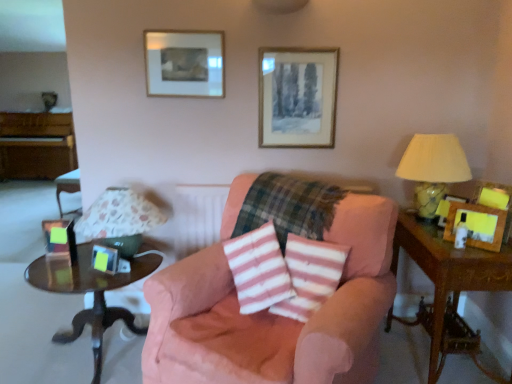
Describe the element at coordinates (90, 290) in the screenshot. Image resolution: width=512 pixels, height=384 pixels. I see `wooden side table at left, the 1th table positioned from the left` at that location.

The width and height of the screenshot is (512, 384). Find the location of `plaid fabric at center`. plaid fabric at center is located at coordinates (288, 206).

Image resolution: width=512 pixels, height=384 pixels. In order to click on gold-framed picture at upper center, the 4th picture frame positioned from the bottom in this screenshot , I will do click(x=297, y=97).

Measure the distance between gold-framed picture at upper center, placed as the 2th picture frame when sorted from right to left, and camera.

The distance of gold-framed picture at upper center, placed as the 2th picture frame when sorted from right to left, from camera is 7.68 feet.

What do you see at coordinates (36, 145) in the screenshot?
I see `wooden piano at left` at bounding box center [36, 145].

You are a GUI agent. You are given a task and a screenshot of the screen. Output one action in this format:
    pyautogui.click(x=<x>, y=<y>)
    Task: Click on the wooden piano at left
    This screenshot has width=512, height=384.
    Given the screenshot: What is the action you would take?
    pyautogui.click(x=36, y=145)

How much space does matte black picture frame at left, which is counted as the 5th picture frame, starting from the right, occupy horizontally?

matte black picture frame at left, which is counted as the 5th picture frame, starting from the right, is 6.41 inches wide.

The height and width of the screenshot is (384, 512). What do you see at coordinates (310, 275) in the screenshot?
I see `pink striped fabric at center` at bounding box center [310, 275].

Identify the location of wooden side table at left, the 1th table positioned from the left. (90, 290).

From a real-world perspective, is yellow fabric lampshade at right, the 2th table lamp viewed from the left, physically above wooden picture frame at right, the first picture frame viewed from the front?

Yes, from a real-world perspective, yellow fabric lampshade at right, the 2th table lamp viewed from the left, is above wooden picture frame at right, the first picture frame viewed from the front.

In the scene shown: Is yellow fabric lampshade at right, the 1th table lamp positioned from the right, outside of wooden picture frame at right, marked as the third picture frame in a top-to-bottom arrangement?

Yes.

Which object is thinner, yellow fabric lampshade at right, the 2th table lamp viewed from the left, or wooden picture frame at right, placed as the 3th picture frame when sorted from bottom to top?

Thinner between the two is wooden picture frame at right, placed as the 3th picture frame when sorted from bottom to top.

From a real-world perspective, is floral fabric lampshade at left, the 2th table lamp viewed from the right, above or below wooden picture frame at upper center, the 5th picture frame when ordered from front to back?

In terms of real-world spatial position, floral fabric lampshade at left, the 2th table lamp viewed from the right, is below wooden picture frame at upper center, the 5th picture frame when ordered from front to back.

Is floral fabric lampshade at left, the 2th table lamp viewed from the right, next to wooden picture frame at upper center, arranged as the 3th picture frame when viewed from the right, and touching it?

floral fabric lampshade at left, the 2th table lamp viewed from the right, is not next to wooden picture frame at upper center, arranged as the 3th picture frame when viewed from the right, and they're not touching.

Is floral fabric lampshade at left, the 2th table lamp viewed from the right, at the left side of wooden picture frame at upper center, which appears as the 5th picture frame when ordered from the bottom?

Correct, you'll find floral fabric lampshade at left, the 2th table lamp viewed from the right, to the left of wooden picture frame at upper center, which appears as the 5th picture frame when ordered from the bottom.

Considering the positions of point (106, 224) and point (201, 66), is point (106, 224) closer or farther from the camera than point (201, 66)?

Point (106, 224) is positioned closer to the camera compared to point (201, 66).

Would you consider wooden side table at right, marked as the 2th table in a left-to-right arrangement, to be distant from yellow fabric lampshade at right, the 1th table lamp positioned from the right?

wooden side table at right, marked as the 2th table in a left-to-right arrangement, is actually quite close to yellow fabric lampshade at right, the 1th table lamp positioned from the right.

In the image, is wooden side table at right, the 1th table positioned from the right, positioned in front of or behind yellow fabric lampshade at right, the 2th table lamp viewed from the left?

wooden side table at right, the 1th table positioned from the right, is in front of yellow fabric lampshade at right, the 2th table lamp viewed from the left.

How different are the orientations of wooden side table at right, the 1th table positioned from the right, and yellow fabric lampshade at right, the 2th table lamp viewed from the left, in degrees?

0.00116 degrees.

From a real-world perspective, is wooden side table at right, marked as the 2th table in a left-to-right arrangement, above or below yellow fabric lampshade at right, the 1th table lamp positioned from the right?

wooden side table at right, marked as the 2th table in a left-to-right arrangement, is below yellow fabric lampshade at right, the 1th table lamp positioned from the right.

Is wooden piano at left to the left of matte black picture frame at left, placed as the third picture frame when sorted from front to back, from the viewer's perspective?

Correct, you'll find wooden piano at left to the left of matte black picture frame at left, placed as the third picture frame when sorted from front to back.

Could you tell me if wooden piano at left is facing matte black picture frame at left, placed as the third picture frame when sorted from front to back?

No, wooden piano at left is not turned towards matte black picture frame at left, placed as the third picture frame when sorted from front to back.

From the image's perspective, which is below, wooden piano at left or matte black picture frame at left, placed as the third picture frame when sorted from front to back?

matte black picture frame at left, placed as the third picture frame when sorted from front to back.

Is wooden piano at left taller than matte black picture frame at left, the third picture frame viewed from the back?

Indeed, wooden piano at left has a greater height compared to matte black picture frame at left, the third picture frame viewed from the back.

Looking at their sizes, would you say pink striped fabric at center is wider or thinner than wooden side table at left, the 1th table positioned from the left?

In the image, pink striped fabric at center appears to be more narrow than wooden side table at left, the 1th table positioned from the left.

From the image's perspective, is pink striped fabric at center located above or below wooden side table at left, the second table when ordered from right to left?

From the image's perspective, pink striped fabric at center appears above wooden side table at left, the second table when ordered from right to left.

In the image, is pink striped fabric at center positioned in front of or behind wooden side table at left, the 1th table positioned from the left?

Clearly, pink striped fabric at center is in front of wooden side table at left, the 1th table positioned from the left.

How many degrees apart are the facing directions of pink striped fabric at center and wooden side table at left, the second table when ordered from right to left?

The facing directions of pink striped fabric at center and wooden side table at left, the second table when ordered from right to left, are 34.6 degrees apart.

From the picture: Which of these two, wooden side table at left, the 1th table positioned from the left, or gold-framed picture at upper center, marked as the second picture frame in a top-to-bottom arrangement, is wider?

wooden side table at left, the 1th table positioned from the left, is wider.

Between wooden side table at left, the 1th table positioned from the left, and gold-framed picture at upper center, arranged as the 4th picture frame when viewed from the front, which one has more height?

gold-framed picture at upper center, arranged as the 4th picture frame when viewed from the front, is taller.

I want to click on the 2nd table below when counting from the gold-framed picture at upper center, the second picture frame in the back-to-front sequence (from the image's perspective), so click(90, 290).

From the image's perspective, which is below, wooden side table at left, the 1th table positioned from the left, or gold-framed picture at upper center, marked as the second picture frame in a top-to-bottom arrangement?

wooden side table at left, the 1th table positioned from the left.

Considering the sizes of objects floral fabric lampshade at left, the 2th table lamp viewed from the right, and wooden side table at left, the 1th table positioned from the left, in the image provided, who is wider, floral fabric lampshade at left, the 2th table lamp viewed from the right, or wooden side table at left, the 1th table positioned from the left,?

Wider between the two is wooden side table at left, the 1th table positioned from the left.

Are floral fabric lampshade at left, marked as the first table lamp in a left-to-right arrangement, and wooden side table at left, the second table when ordered from right to left, far apart?

floral fabric lampshade at left, marked as the first table lamp in a left-to-right arrangement, is near wooden side table at left, the second table when ordered from right to left, not far away.

Is floral fabric lampshade at left, marked as the first table lamp in a left-to-right arrangement, to the right of wooden side table at left, the second table when ordered from right to left, from the viewer's perspective?

Yes, floral fabric lampshade at left, marked as the first table lamp in a left-to-right arrangement, is to the right of wooden side table at left, the second table when ordered from right to left.

Image resolution: width=512 pixels, height=384 pixels. I want to click on the 1st picture frame directly beneath the yellow fabric lampshade at right, the 2th table lamp viewed from the left (from a real-world perspective), so click(477, 225).

Where is `the 4th picture frame behind when counting from the floral fabric lampshade at left, the 2th table lamp viewed from the right`? the 4th picture frame behind when counting from the floral fabric lampshade at left, the 2th table lamp viewed from the right is located at coordinates [x=184, y=63].

Which object lies further to the anchor point pink fabric chair at center, wooden picture frame at right, the first picture frame viewed from the right, or wooden side table at left, the 1th table positioned from the left?

wooden picture frame at right, the first picture frame viewed from the right, is positioned further to the anchor pink fabric chair at center.

Looking at this image, looking at the image, which one is located further to pink fabric chair at center, wooden piano at left or matte black picture frame at left, which is counted as the 5th picture frame, starting from the right?

Among the two, wooden piano at left is located further to pink fabric chair at center.

Which object lies nearer to the anchor point plaid fabric at center, metallic silver picture frame at lower left, which ranks as the 2th picture frame in front-to-back order, or wooden piano at left?

Based on the image, metallic silver picture frame at lower left, which ranks as the 2th picture frame in front-to-back order, appears to be nearer to plaid fabric at center.

In the scene shown: Considering their positions, is pink fabric chair at center positioned closer to wooden piano at left than wooden side table at right, the 1th table positioned from the right?

pink fabric chair at center lies closer to wooden piano at left than the other object.

Which object lies further to the anchor point wooden side table at right, the 1th table positioned from the right, wooden picture frame at right, the first picture frame viewed from the front, or plaid fabric at center?

plaid fabric at center.

Based on their spatial positions, is gold-framed picture at upper center, arranged as the 4th picture frame when viewed from the front, or wooden picture frame at right, placed as the fifth picture frame when sorted from left to right, closer to wooden picture frame at upper center, marked as the 3th picture frame in a left-to-right arrangement?

Among the two, gold-framed picture at upper center, arranged as the 4th picture frame when viewed from the front, is located nearer to wooden picture frame at upper center, marked as the 3th picture frame in a left-to-right arrangement.

Which object lies nearer to the anchor point matte black picture frame at left, arranged as the fourth picture frame when viewed from the top, metallic silver picture frame at lower left, which is counted as the 1th picture frame, starting from the bottom, or gold-framed picture at upper center, the second picture frame in the back-to-front sequence?

metallic silver picture frame at lower left, which is counted as the 1th picture frame, starting from the bottom, is positioned closer to the anchor matte black picture frame at left, arranged as the fourth picture frame when viewed from the top.

Considering their positions, is floral fabric lampshade at left, marked as the first table lamp in a left-to-right arrangement, positioned closer to pink striped fabric at center than metallic silver picture frame at lower left, the second picture frame when ordered from left to right?

Based on the image, floral fabric lampshade at left, marked as the first table lamp in a left-to-right arrangement, appears to be nearer to pink striped fabric at center.

You are a GUI agent. You are given a task and a screenshot of the screen. Output one action in this format:
    pyautogui.click(x=<x>, y=<y>)
    Task: Click on the table lamp between floral fabric lampshade at left, the 2th table lamp viewed from the right, and wooden side table at right, marked as the 2th table in a left-to-right arrangement
    This screenshot has height=384, width=512.
    Given the screenshot: What is the action you would take?
    pyautogui.click(x=433, y=169)

At what (x,y) coordinates should I click in order to perform the action: click on throw pillow between floral fabric lampshade at left, marked as the first table lamp in a left-to-right arrangement, and gold-framed picture at upper center, marked as the second picture frame in a top-to-bottom arrangement. Please return your answer as a coordinate pair (x, y). This screenshot has height=384, width=512. Looking at the image, I should click on (310, 275).

This screenshot has height=384, width=512. What are the coordinates of `picture frame between gold-framed picture at upper center, arranged as the 4th picture frame when viewed from the front, and wooden piano at left in the front-back direction` in the screenshot? It's located at (184, 63).

Find the location of `plaid between wooden picture frame at upper center, the first picture frame viewed from the back, and wooden side table at right, the 1th table positioned from the right`. plaid between wooden picture frame at upper center, the first picture frame viewed from the back, and wooden side table at right, the 1th table positioned from the right is located at coordinates (288, 206).